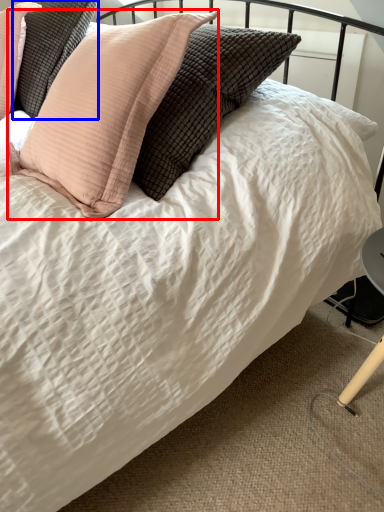
Question: Among these objects, which one is nearest to the camera, pillow (highlighted by a red box) or pillow (highlighted by a blue box)?

Choices:
 (A) pillow
 (B) pillow

Answer: (A)